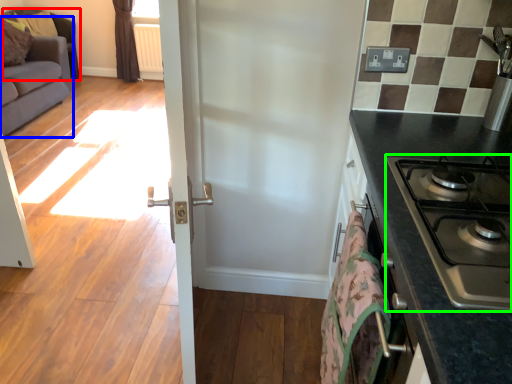
Question: Which is farther away from armchair (highlighted by a red box)? studio couch (highlighted by a blue box) or gas stove (highlighted by a green box)?

Choices:
 (A) studio couch
 (B) gas stove

Answer: (B)